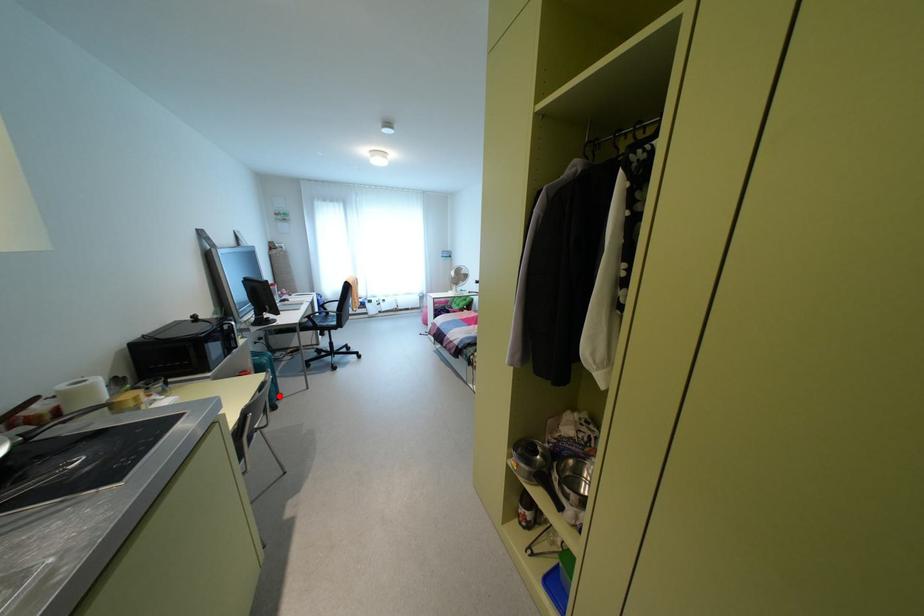
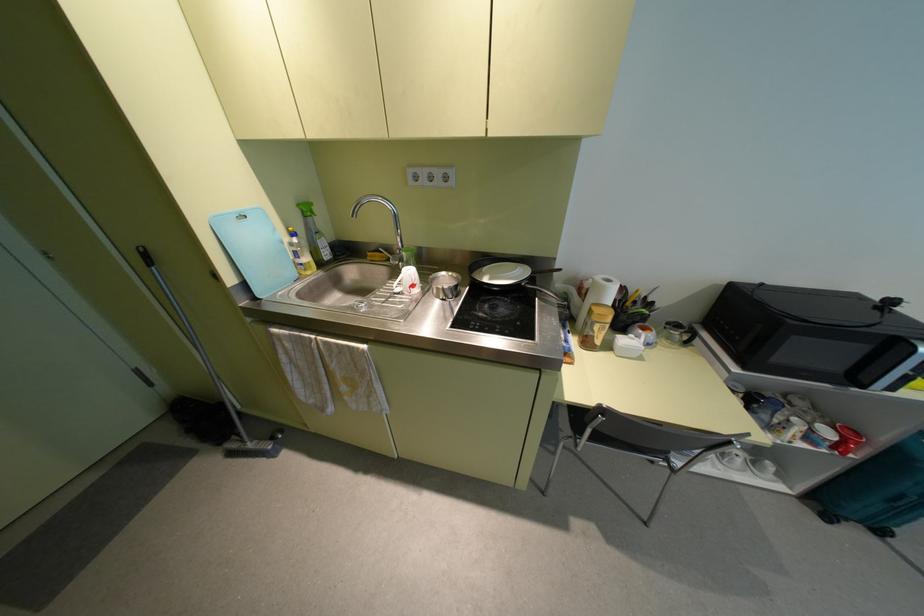
Question: I am providing you with two images of the same scene from different viewpoints. In image1, a red point is highlighted. Considering the same 3D point in image2, which of the following is correct?

Choices:
 (A) It is closer
 (B) It is farther

Answer: (B)